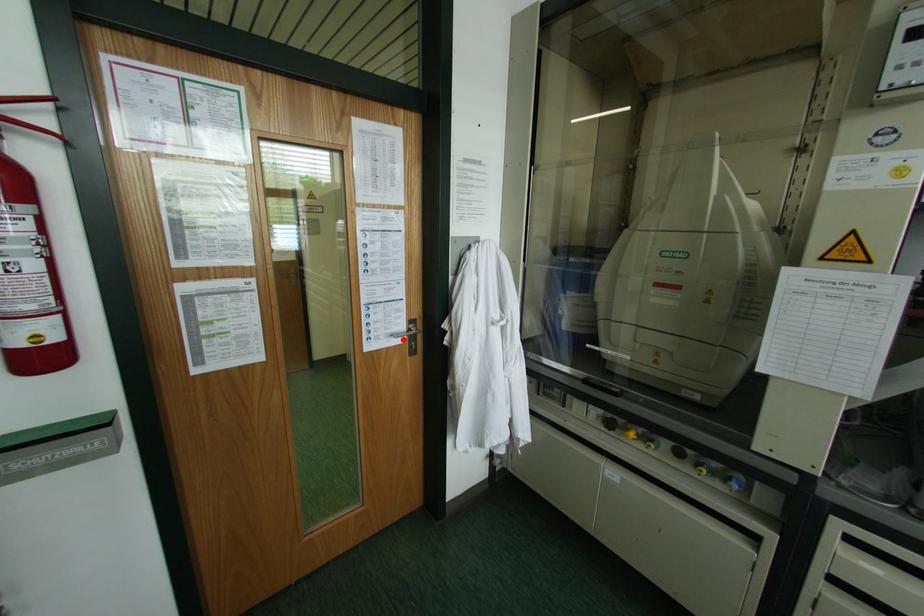
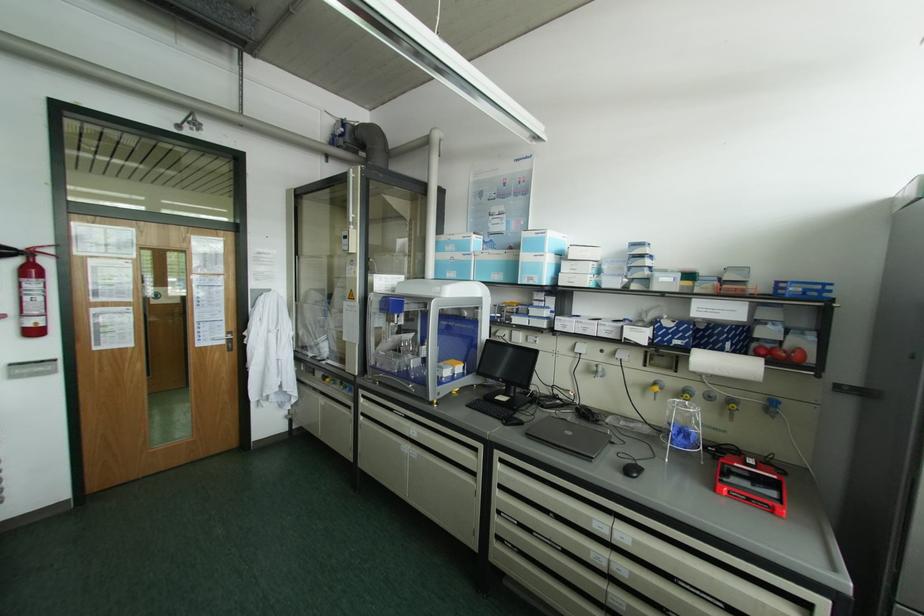
The point at the highlighted location is marked in the first image. Where is the corresponding point in the second image?

(224, 342)